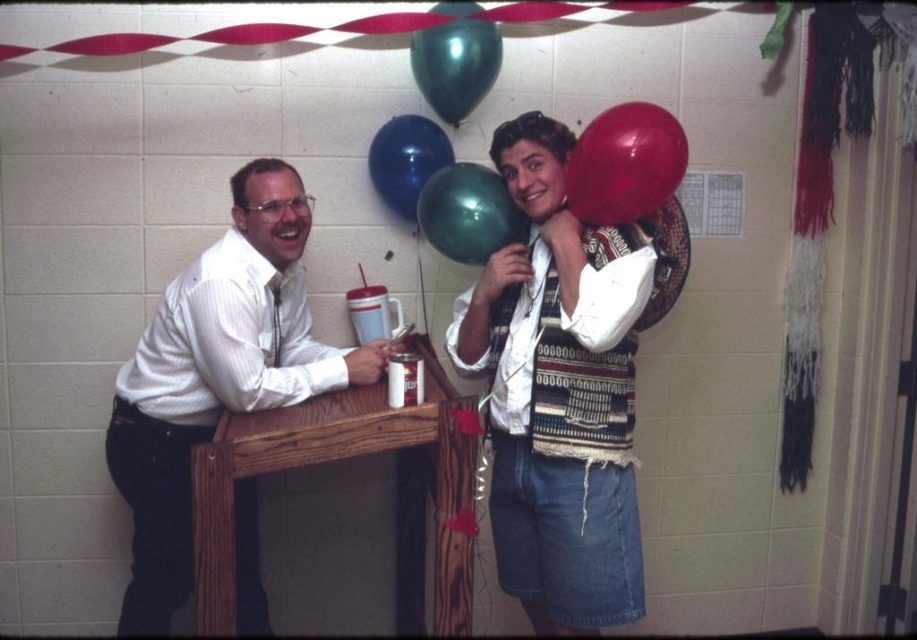
Question: Which point is closer to the camera taking this photo?

Choices:
 (A) (494, 28)
 (B) (570, 429)
 (C) (403, 394)

Answer: (C)

Question: Observing the image, what is the correct spatial positioning of white striped shirt at center in reference to green metallic balloon at upper center?

Choices:
 (A) right
 (B) left

Answer: (A)

Question: Can you confirm if blue glossy balloon at upper center is positioned above metallic silver can at table?

Choices:
 (A) no
 (B) yes

Answer: (B)

Question: Does green matte balloon at upper center have a larger size compared to green metallic balloon at upper center?

Choices:
 (A) yes
 (B) no

Answer: (B)

Question: Among these objects, which one is nearest to the camera?

Choices:
 (A) green matte balloon at upper center
 (B) knitted sweater at upper right
 (C) rubberized glossy balloon at upper right

Answer: (B)

Question: Which point is farther to the camera?

Choices:
 (A) (189, 323)
 (B) (423, 45)
 (C) (580, 308)
 (D) (393, 380)

Answer: (B)